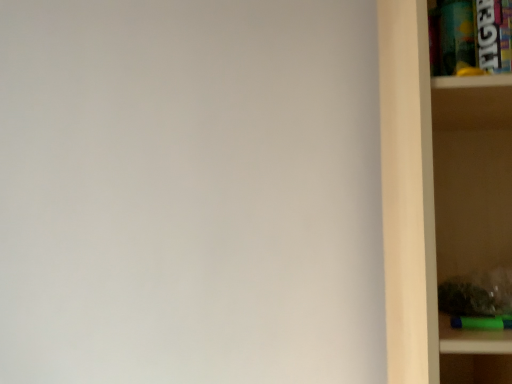
The width and height of the screenshot is (512, 384). Describe the element at coordinates (477, 35) in the screenshot. I see `metallic plastic cabinet at upper right` at that location.

Looking at this image, what is the approximate height of metallic plastic cabinet at upper right?

It is 7.57 inches.

You are a GUI agent. You are given a task and a screenshot of the screen. Output one action in this format:
    pyautogui.click(x=<x>, y=<y>)
    Task: Click on the metallic plastic cabinet at upper right
    The width and height of the screenshot is (512, 384).
    Given the screenshot: What is the action you would take?
    pyautogui.click(x=477, y=35)

The height and width of the screenshot is (384, 512). I want to click on wooden shelf at right, so click(440, 201).

What do you see at coordinates (440, 201) in the screenshot? The height and width of the screenshot is (384, 512). I see `wooden shelf at right` at bounding box center [440, 201].

Image resolution: width=512 pixels, height=384 pixels. I want to click on metallic plastic cabinet at upper right, so [x=477, y=35].

Can you confirm if wooden shelf at right is positioned to the left of metallic plastic cabinet at upper right?

No.

Which object is further away from the camera, wooden shelf at right or metallic plastic cabinet at upper right?

metallic plastic cabinet at upper right is behind.

Considering the positions of points (410, 140) and (450, 48), is point (410, 140) closer to camera compared to point (450, 48)?

Yes, it is in front of point (450, 48).

From the image's perspective, is wooden shelf at right beneath metallic plastic cabinet at upper right?

Indeed, from the image's perspective, wooden shelf at right is shown beneath metallic plastic cabinet at upper right.

From a real-world perspective, relative to metallic plastic cabinet at upper right, is wooden shelf at right vertically above or below?

wooden shelf at right is below metallic plastic cabinet at upper right.

Which of these two, wooden shelf at right or metallic plastic cabinet at upper right, is wider?

wooden shelf at right is wider.

Can you confirm if wooden shelf at right is taller than metallic plastic cabinet at upper right?

Yes, wooden shelf at right is taller than metallic plastic cabinet at upper right.

Can you confirm if wooden shelf at right is bigger than metallic plastic cabinet at upper right?

Indeed, wooden shelf at right has a larger size compared to metallic plastic cabinet at upper right.

Consider the image. Is wooden shelf at right surrounding metallic plastic cabinet at upper right?

Absolutely, metallic plastic cabinet at upper right is inside wooden shelf at right.

Are wooden shelf at right and metallic plastic cabinet at upper right located far from each other?

No, wooden shelf at right is in close proximity to metallic plastic cabinet at upper right.

Could you tell me if wooden shelf at right is facing metallic plastic cabinet at upper right?

Yes, wooden shelf at right is oriented towards metallic plastic cabinet at upper right.

At what (x,y) coordinates should I click in order to perform the action: click on shelf below the metallic plastic cabinet at upper right (from the image's perspective). Please return your answer as a coordinate pair (x, y). The width and height of the screenshot is (512, 384). Looking at the image, I should click on coord(440,201).

Considering the positions of objects metallic plastic cabinet at upper right and wooden shelf at right in the image provided, who is more to the right, metallic plastic cabinet at upper right or wooden shelf at right?

wooden shelf at right.

Considering the relative positions of metallic plastic cabinet at upper right and wooden shelf at right in the image provided, is metallic plastic cabinet at upper right behind wooden shelf at right?

Yes, it is behind wooden shelf at right.

Which is nearer, (441,29) or (460,346)?

Point (441,29) is farther from the camera than point (460,346).

From the image's perspective, is metallic plastic cabinet at upper right under wooden shelf at right?

No.

Consider the image. From a real-world perspective, is metallic plastic cabinet at upper right above or below wooden shelf at right?

In terms of real-world spatial position, metallic plastic cabinet at upper right is above wooden shelf at right.

Looking at their sizes, would you say metallic plastic cabinet at upper right is wider or thinner than wooden shelf at right?

Considering their sizes, metallic plastic cabinet at upper right looks slimmer than wooden shelf at right.

In the scene shown: Who is shorter, metallic plastic cabinet at upper right or wooden shelf at right?

metallic plastic cabinet at upper right is shorter.

Can you confirm if metallic plastic cabinet at upper right is bigger than wooden shelf at right?

Actually, metallic plastic cabinet at upper right might be smaller than wooden shelf at right.

Is metallic plastic cabinet at upper right spatially inside wooden shelf at right, or outside of it?

metallic plastic cabinet at upper right is enclosed within wooden shelf at right.

Would you say metallic plastic cabinet at upper right is a long distance from wooden shelf at right?

That's not correct — metallic plastic cabinet at upper right is a little close to wooden shelf at right.

Could you tell me if metallic plastic cabinet at upper right is facing wooden shelf at right?

Yes, metallic plastic cabinet at upper right is aimed at wooden shelf at right.

What's the angular difference between metallic plastic cabinet at upper right and wooden shelf at right's facing directions?

0.61 degrees.

Where is `cabinet on the left of wooden shelf at right`? Image resolution: width=512 pixels, height=384 pixels. cabinet on the left of wooden shelf at right is located at coordinates (477, 35).

You are a GUI agent. You are given a task and a screenshot of the screen. Output one action in this format:
    pyautogui.click(x=<x>, y=<y>)
    Task: Click on the shelf located on the right of metallic plastic cabinet at upper right
    
    Given the screenshot: What is the action you would take?
    pyautogui.click(x=440, y=201)

At what (x,y) coordinates should I click in order to perform the action: click on cabinet that appears on the left of wooden shelf at right. Please return your answer as a coordinate pair (x, y). The width and height of the screenshot is (512, 384). Looking at the image, I should click on (477, 35).